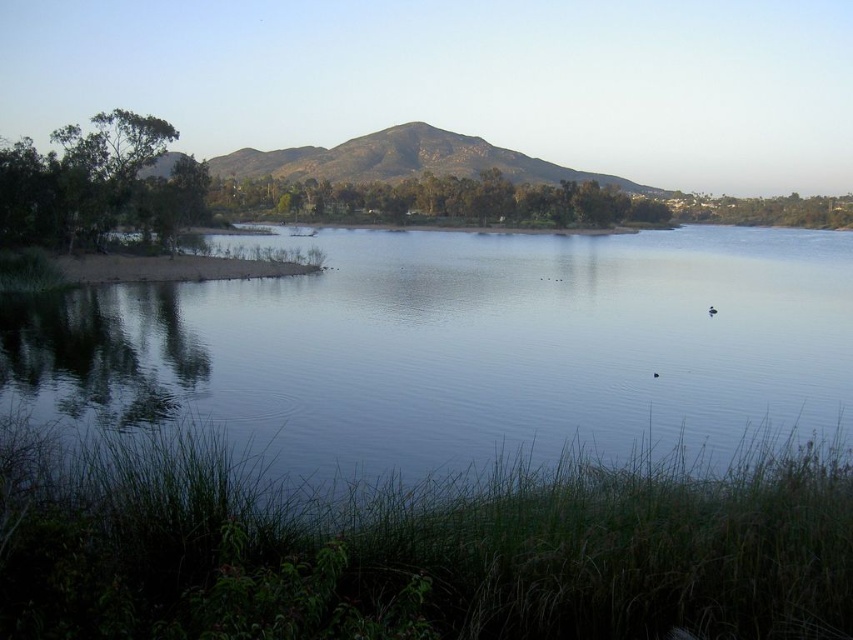
Question: Does clear water at center lie behind brown/dry soil mountain at center?

Choices:
 (A) yes
 (B) no

Answer: (B)

Question: Does clear water at center appear on the left side of brown/dry soil mountain at center?

Choices:
 (A) yes
 (B) no

Answer: (A)

Question: Which of the following is the closest to the observer?

Choices:
 (A) clear water at center
 (B) brown/dry soil mountain at center

Answer: (A)

Question: Considering the relative positions of clear water at center and brown/dry soil mountain at center in the image provided, where is clear water at center located with respect to brown/dry soil mountain at center?

Choices:
 (A) below
 (B) above

Answer: (A)